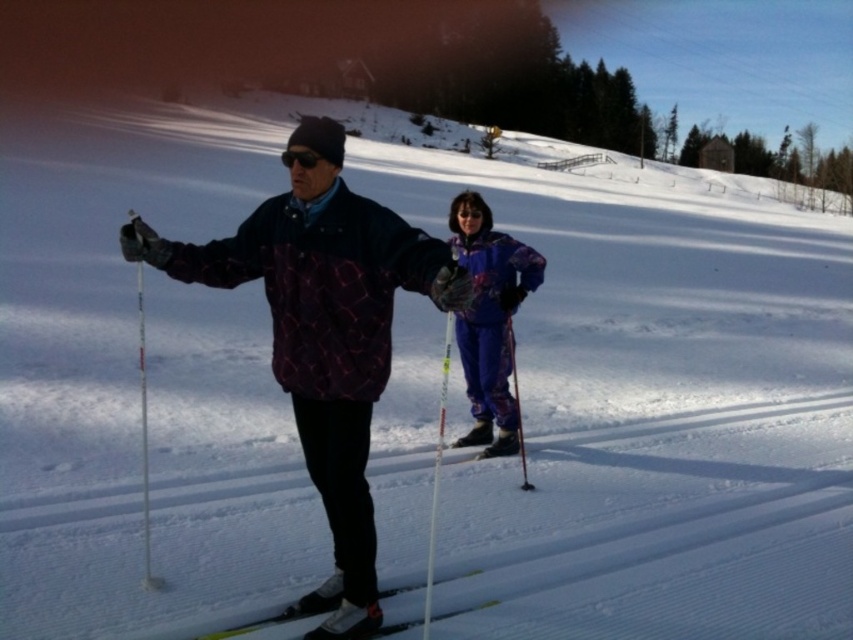
Can you confirm if matte purple ski suit at center is bigger than white plastic ski pole at center?

No.

Does matte purple ski suit at center have a lesser height compared to white plastic ski pole at center?

Yes, matte purple ski suit at center is shorter than white plastic ski pole at center.

Between point (476, 400) and point (451, 321), which one is positioned behind?

The point (451, 321) is behind.

Locate an element on the screen. The image size is (853, 640). matte purple ski suit at center is located at coordinates (489, 320).

Is white plastic ski pole at center wider than matte black ski pole at center?

No, white plastic ski pole at center is not wider than matte black ski pole at center.

Is point (444, 365) in front of point (520, 419)?

No, it is behind (520, 419).

Find the location of a particular element. This screenshot has width=853, height=640. white plastic ski pole at center is located at coordinates (437, 474).

Find the location of a particular element. white plastic ski pole at center is located at coordinates (437, 474).

Consider the image. Does white plastic ski pole at left have a greater height compared to yellow matte ski at lower center?

Indeed, white plastic ski pole at left has a greater height compared to yellow matte ski at lower center.

Is point (144, 531) positioned before point (315, 614)?

No.

Locate an element on the screen. The height and width of the screenshot is (640, 853). white plastic ski pole at left is located at coordinates (144, 440).